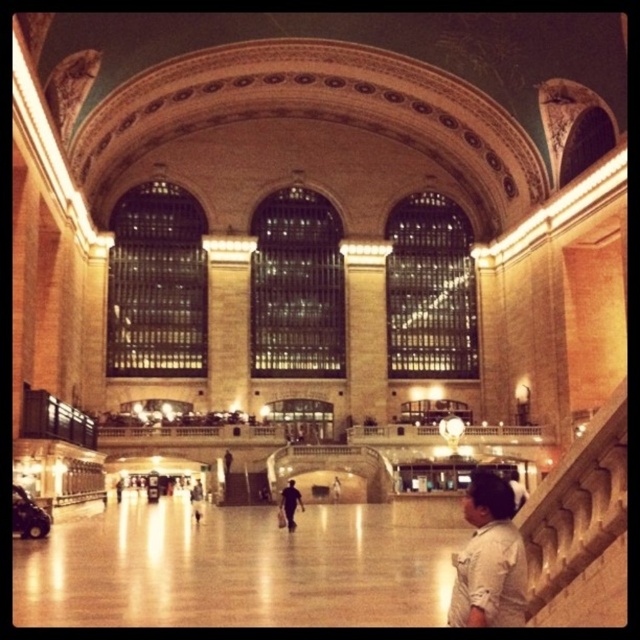
Question: Can you confirm if dark blue uniform at center is positioned to the right of light blue jeans at center?

Choices:
 (A) yes
 (B) no

Answer: (A)

Question: Which point is closer to the camera taking this photo?

Choices:
 (A) (477, 564)
 (B) (200, 499)

Answer: (A)

Question: Is white cotton shirt at lower right smaller than dark blue uniform at center?

Choices:
 (A) no
 (B) yes

Answer: (A)

Question: Which point is closer to the camera taking this photo?

Choices:
 (A) (292, 522)
 (B) (476, 618)

Answer: (B)

Question: Is white cotton shirt at lower right bigger than dark blue uniform at center?

Choices:
 (A) yes
 (B) no

Answer: (A)

Question: Which object appears closest to the camera in this image?

Choices:
 (A) white cotton shirt at lower right
 (B) light blue jeans at center
 (C) dark blue uniform at center

Answer: (A)